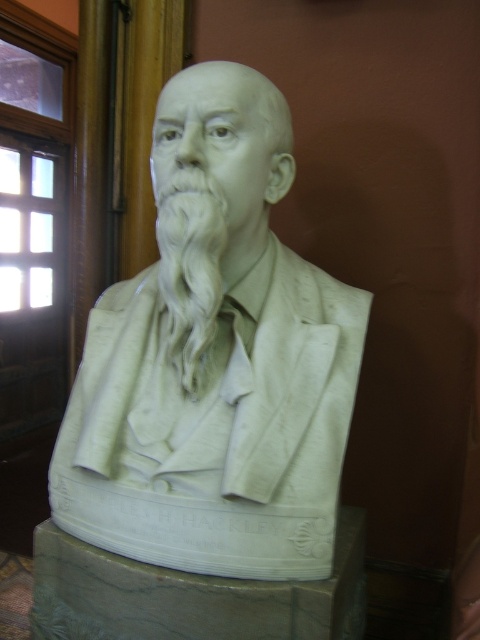
Consider the image. You are an art conservator examining the white marble bust at center and the white marble beard at center. Which part of the sculpture is positioned closer to you?

The white marble bust at center is closer to the viewer than the white marble beard at center.

You are an art conservator examining the white marble bust at center and the white marble beard at center. Which object is bigger?

The white marble bust at center is larger than the white marble beard at center.